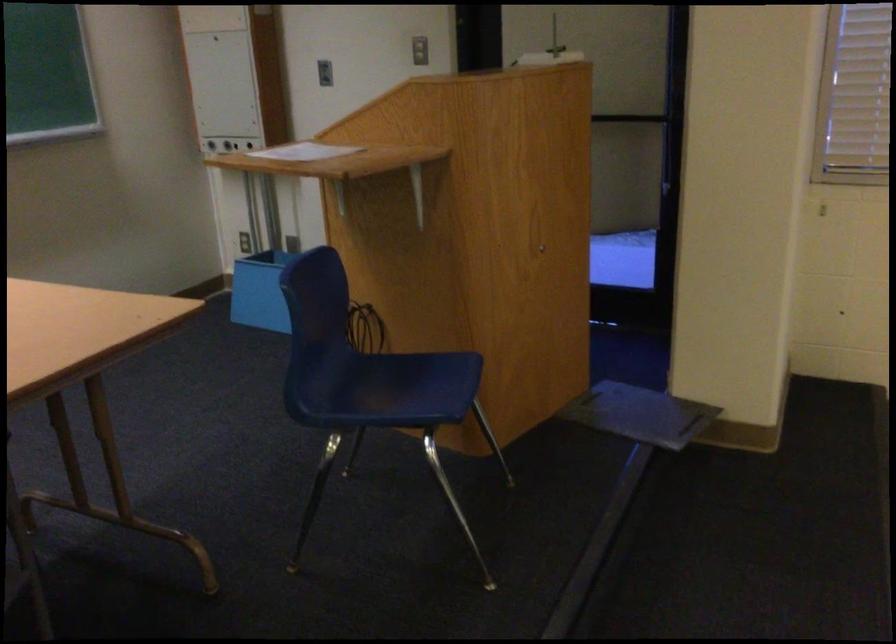
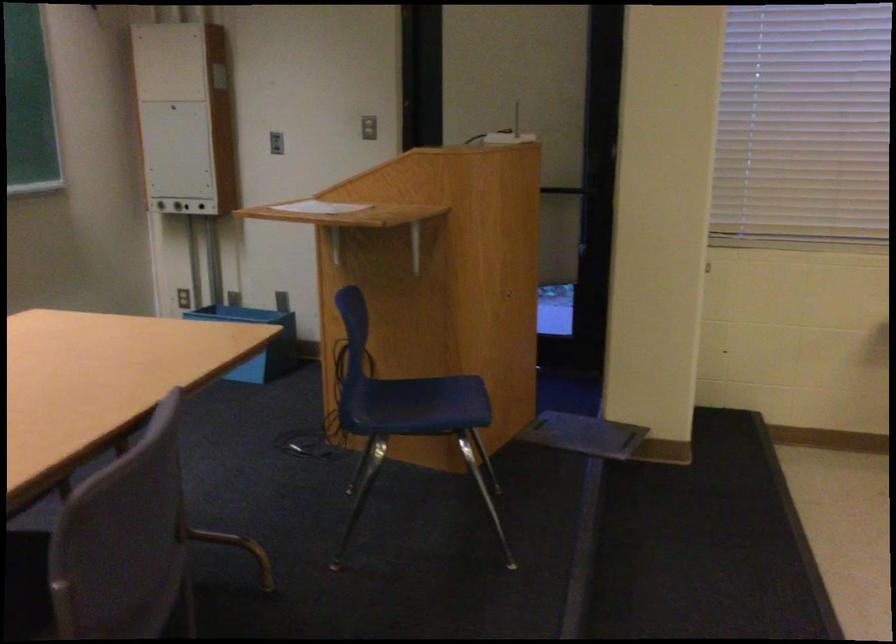
The point at (317, 151) is marked in the first image. Where is the corresponding point in the second image?

(320, 207)